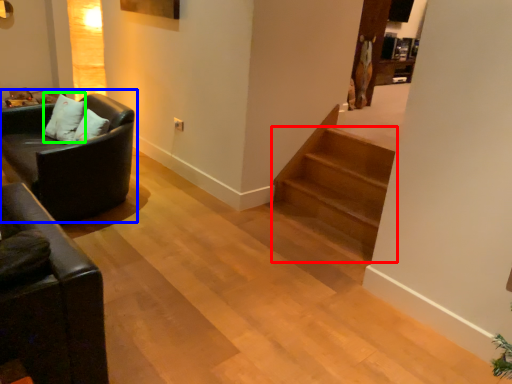
Question: Which object is positioned closest to stairs (highlighted by a red box)? Select from studio couch (highlighted by a blue box) and pillow (highlighted by a green box).

Choices:
 (A) studio couch
 (B) pillow

Answer: (A)